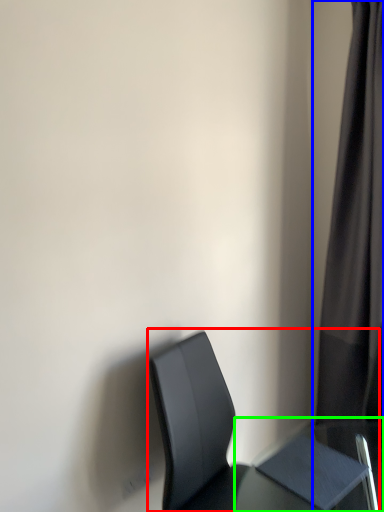
Question: Considering the real-world distances, which object is closest to chair (highlighted by a red box)? curtain (highlighted by a blue box) or table (highlighted by a green box).

Choices:
 (A) curtain
 (B) table

Answer: (B)